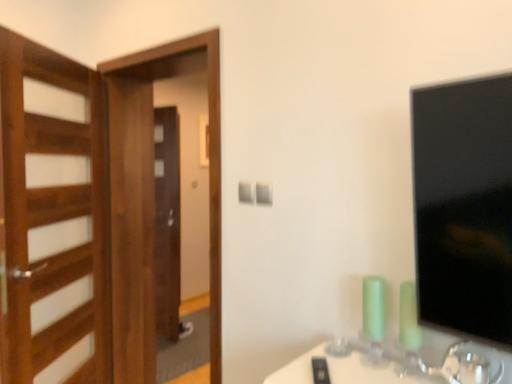
Question: Is wooden door at left taller than wooden screen door at left?

Choices:
 (A) yes
 (B) no

Answer: (B)

Question: Is wooden screen door at left completely or partially inside wooden door at left?

Choices:
 (A) yes
 (B) no

Answer: (B)

Question: Is wooden door at left aimed at wooden screen door at left?

Choices:
 (A) yes
 (B) no

Answer: (A)

Question: From the image's perspective, is wooden door at left over wooden screen door at left?

Choices:
 (A) no
 (B) yes

Answer: (B)

Question: Is wooden door at left thinner than wooden screen door at left?

Choices:
 (A) no
 (B) yes

Answer: (B)

Question: Is the position of wooden door at left more distant than that of wooden screen door at left?

Choices:
 (A) no
 (B) yes

Answer: (A)

Question: Considering the relative positions of wooden screen door at left and wooden door at left in the image provided, is wooden screen door at left in front of wooden door at left?

Choices:
 (A) yes
 (B) no

Answer: (B)

Question: Considering the relative sizes of wooden screen door at left and wooden door at left in the image provided, is wooden screen door at left shorter than wooden door at left?

Choices:
 (A) no
 (B) yes

Answer: (A)

Question: Is wooden screen door at left behind wooden door at left?

Choices:
 (A) yes
 (B) no

Answer: (A)

Question: Does wooden screen door at left turn towards wooden door at left?

Choices:
 (A) no
 (B) yes

Answer: (B)

Question: Could wooden door at left be considered to be inside wooden screen door at left?

Choices:
 (A) no
 (B) yes

Answer: (A)

Question: Is wooden screen door at left facing away from wooden door at left?

Choices:
 (A) no
 (B) yes

Answer: (B)

Question: Relative to wooden door at left, is wooden screen door at left in front or behind?

Choices:
 (A) front
 (B) behind

Answer: (B)